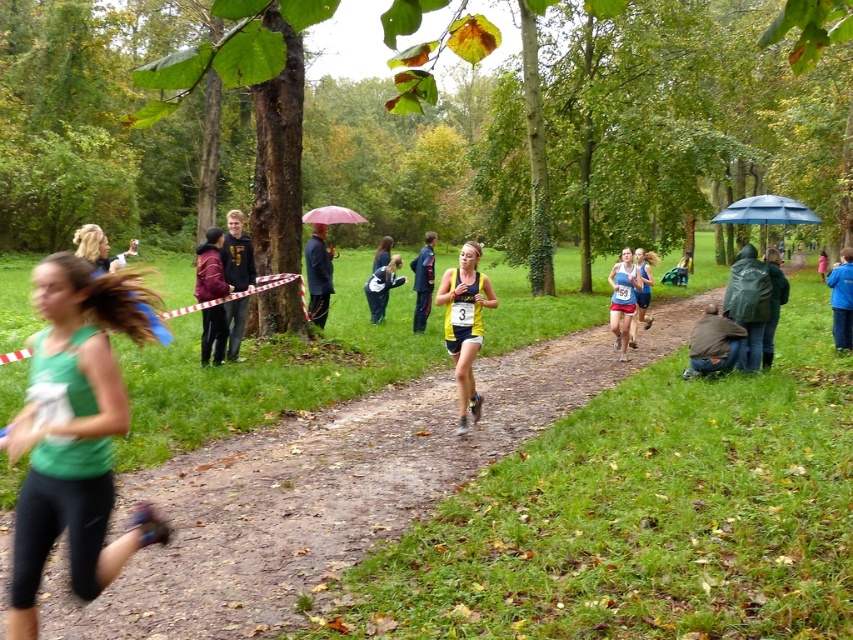
You are a spectator at the cross country race and you see the dark blue jacket at center and the pink fabric umbrella at center. Which object is smaller in size?

The dark blue jacket at center is smaller in size compared to the pink fabric umbrella at center.

You are a spectator at the cross country race and you see the green fabric tank top at left and the dark blue jacket at center. Which clothing item appears smaller in size?

The green fabric tank top at left appears smaller than the dark blue jacket at center.

Based on the coordinates provided, which object in the image is located at point (x=74, y=435)?

The point (x=74, y=435) corresponds to the green fabric tank top at left.